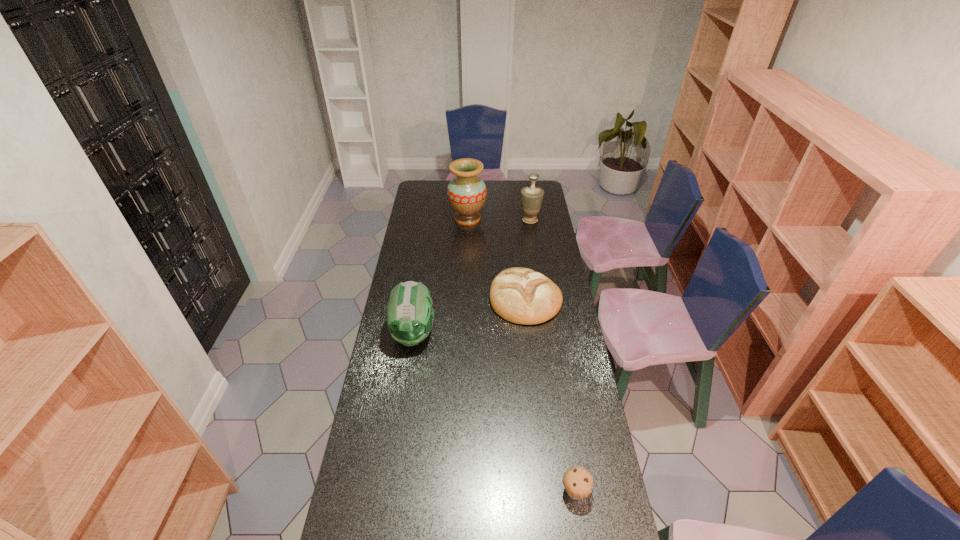
The width and height of the screenshot is (960, 540). Find the location of `free space between the leftmost object and the nearest object`. free space between the leftmost object and the nearest object is located at coordinates (494, 413).

Identify which object is the second closest to the second object from left to right. Please provide its 2D coordinates. Your answer should be formatted as a tuple, i.e. [(x, y)], where the tuple contains the x and y coordinates of a point satisfying the conditions above.

[(520, 295)]

This screenshot has height=540, width=960. Find the location of `the closest object to the leftmost object`. the closest object to the leftmost object is located at coordinates (520, 295).

The image size is (960, 540). What are the coordinates of `vacant space that satisfies the following two spatial constraints: 1. on the front side of the urn; 2. on the left side of the tallest object` in the screenshot? It's located at (468, 220).